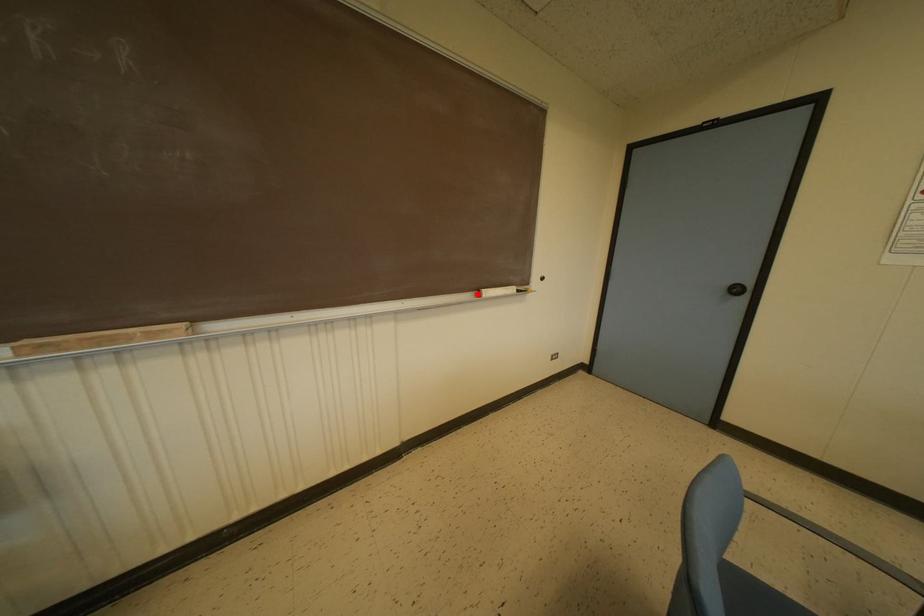
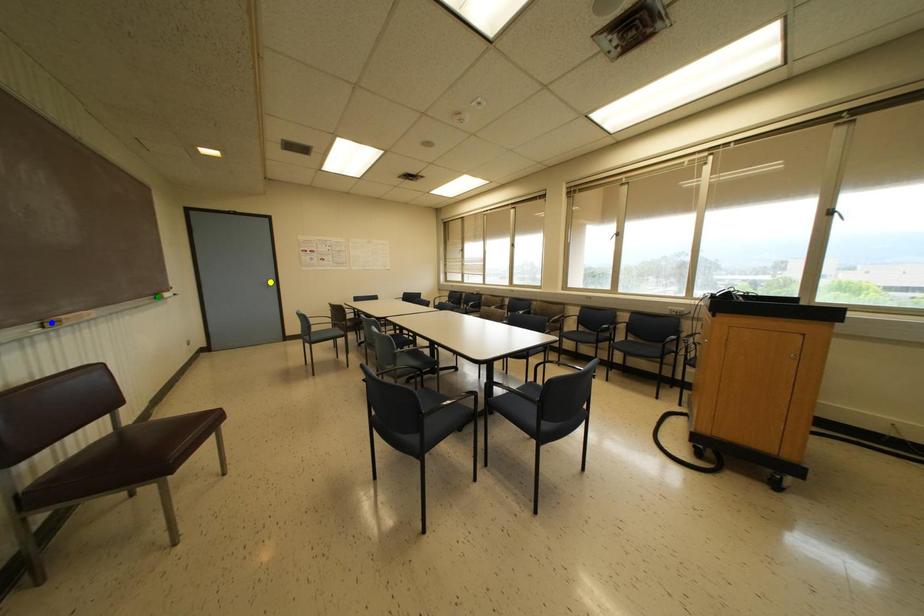
Question: I am providing you with two images of the same scene from different viewpoints. A red point is marked on the first image. You are given multiple points on the second image. Can you choose the point in image 2 that corresponds to the point in image 1?

Choices:
 (A) green point
 (B) yellow point
 (C) blue point

Answer: (A)